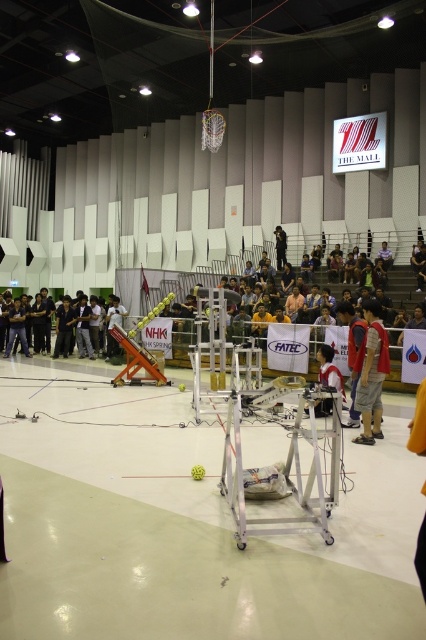
Looking at this image, you are a spectator at the robotics event and want to take a photo of both the red fabric shirt at right and the black matte person at center. Which object is wider so that it can be framed better in your camera?

The red fabric shirt at right is wider than the black matte person at center, so it can be framed better in your camera.

You are a spectator at the robotics competition and notice two people in the arena. One is wearing a dark gray shirt at center and the other is a black matte person at center. Which one is positioned to the left?

The dark gray shirt at center is to the left of the black matte person at center.